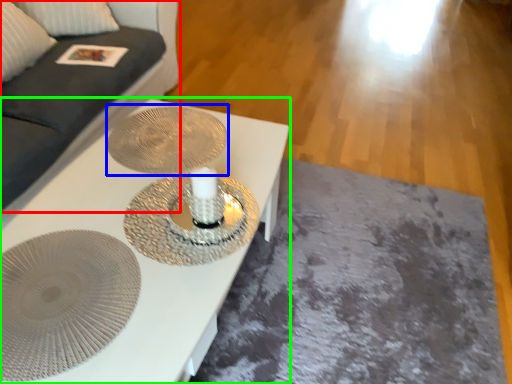
Question: Which object is the closest to the couch (highlighted by a red box)? Choose among these: oval (highlighted by a blue box) or table (highlighted by a green box).

Choices:
 (A) oval
 (B) table

Answer: (A)